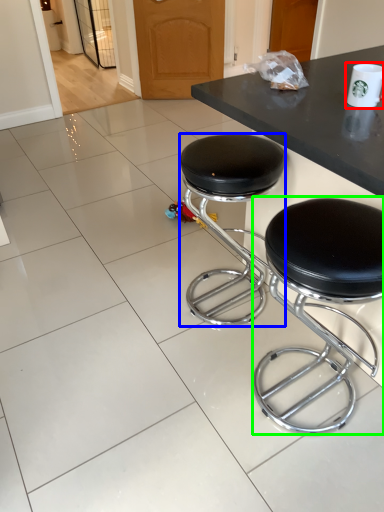
Question: Based on their relative distances, which object is farther from paper cup (highlighted by a red box)? Choose from stool (highlighted by a blue box) and stool (highlighted by a green box).

Choices:
 (A) stool
 (B) stool

Answer: (A)